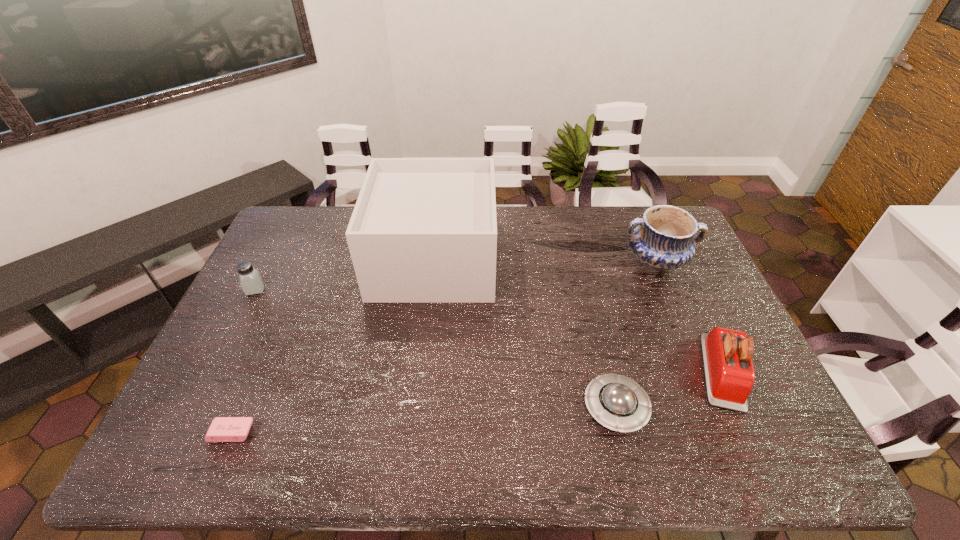
In order to click on saltshaker that is positioned at the left edge in this screenshot , I will do `click(250, 279)`.

The height and width of the screenshot is (540, 960). In order to click on eraser present at the left edge in this screenshot , I will do `click(222, 429)`.

This screenshot has width=960, height=540. In order to click on pottery situated at the right edge in this screenshot , I will do `click(663, 240)`.

This screenshot has height=540, width=960. Find the location of `toaster situated at the right edge`. toaster situated at the right edge is located at coordinates (727, 354).

Identify the location of object that is at the near left corner. The image size is (960, 540). (222, 429).

The image size is (960, 540). What are the coordinates of `object present at the far right corner` in the screenshot? It's located at (663, 240).

What are the coordinates of `vacant space at the far edge of the desktop` in the screenshot? It's located at (537, 225).

Find the location of a particular element. free space at the near edge of the desktop is located at coordinates (705, 463).

This screenshot has height=540, width=960. I want to click on free space at the left edge, so click(x=237, y=390).

In the image, there is a desktop. Identify the location of vacant space at the right edge. (704, 289).